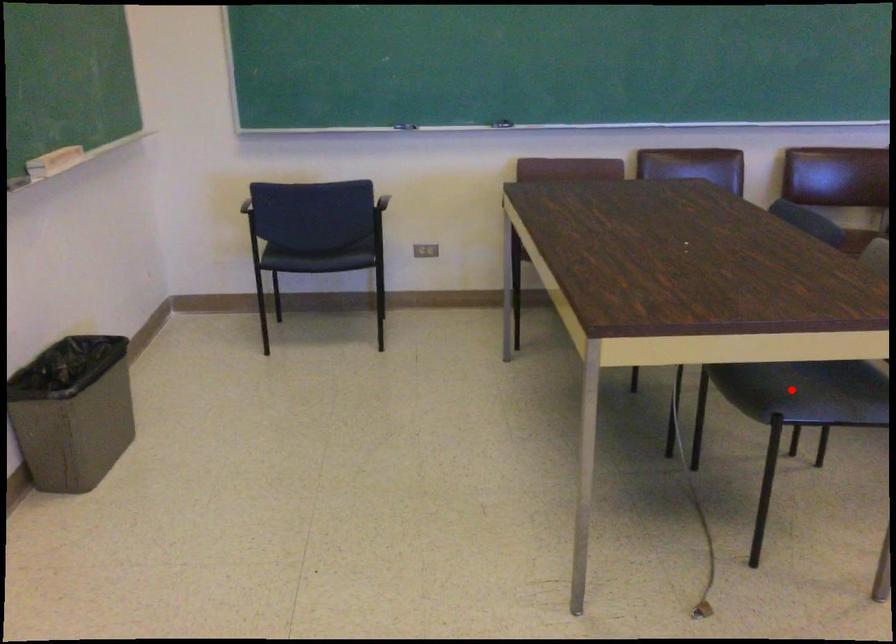
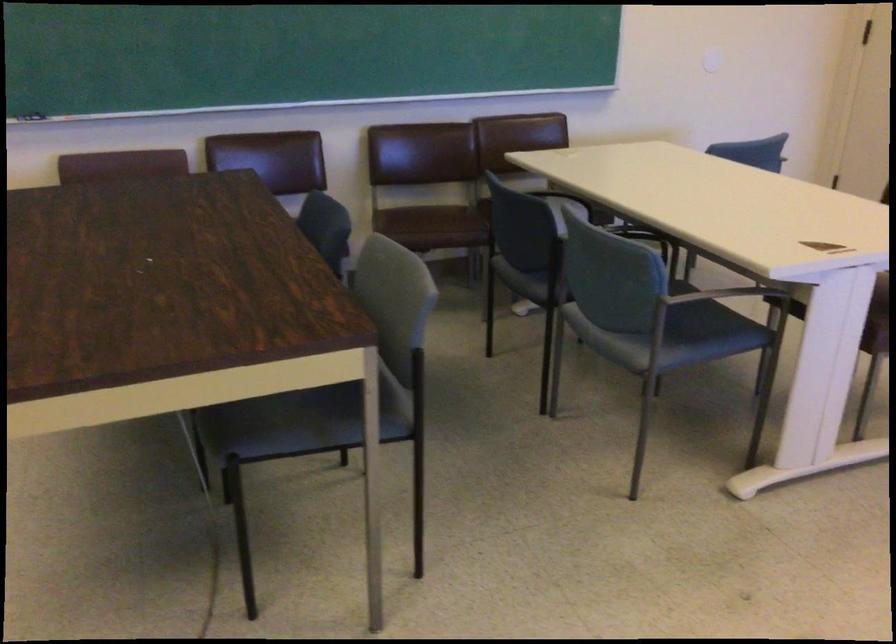
Question: I am providing you with two images of the same scene from different viewpoints. Given a red point in image1, look at the same physical point in image2. Is it:

Choices:
 (A) Closer to the viewpoint
 (B) Farther from the viewpoint

Answer: (A)